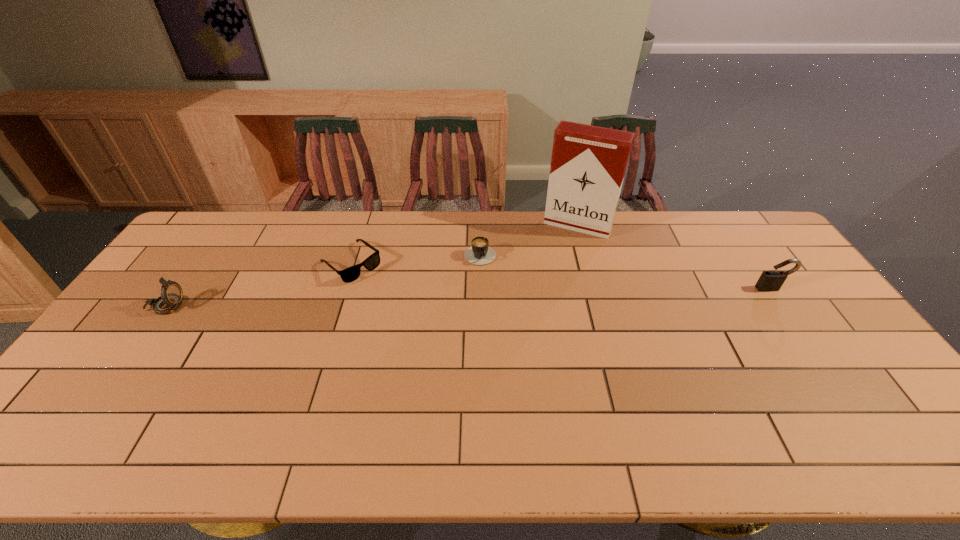
At what (x,y) coordinates should I click in order to perform the action: click on the leftmost object. Please return your answer as a coordinate pair (x, y). Looking at the image, I should click on (171, 292).

At what (x,y) coordinates should I click in order to perform the action: click on compass. Please return your answer as a coordinate pair (x, y). The height and width of the screenshot is (540, 960). Looking at the image, I should click on (171, 292).

Find the location of a particular element. Image resolution: width=960 pixels, height=540 pixels. the rightmost object is located at coordinates (771, 280).

Identify the location of cigarette_case. The height and width of the screenshot is (540, 960). (588, 163).

In order to click on the tallest object in this screenshot , I will do `click(588, 163)`.

The width and height of the screenshot is (960, 540). Identify the location of the second object from left to right. (350, 274).

This screenshot has height=540, width=960. I want to click on cappuccino, so click(480, 253).

The width and height of the screenshot is (960, 540). Identify the location of vacant area situated 0.270m on the face of the compass. pos(276,306).

Identify the location of vacant space situated with the keyhole on the front of the rightmost object. (811, 346).

At what (x,y) coordinates should I click in order to perform the action: click on blank space located on the front-facing side of the fourth object from left to right. Please return your answer as a coordinate pair (x, y). Image resolution: width=960 pixels, height=540 pixels. Looking at the image, I should click on (545, 287).